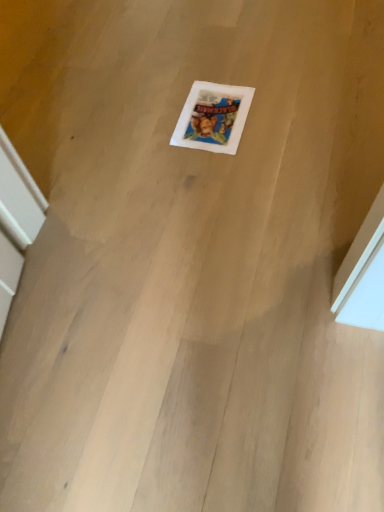
Locate an element on the screen. The height and width of the screenshot is (512, 384). unoccupied space behind white matte picture frame at center is located at coordinates (202, 67).